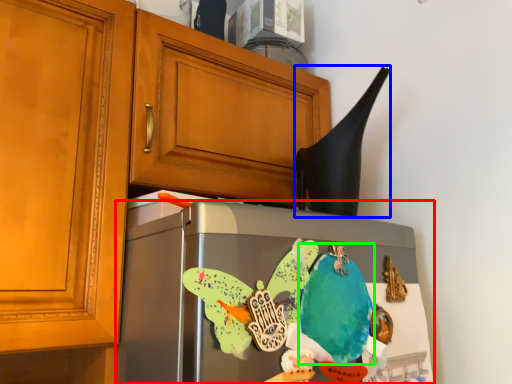
Question: Which object is the closest to the refrigerator (highlighted by a red box)? Choose among these: exhaust hood (highlighted by a blue box) or parrot (highlighted by a green box).

Choices:
 (A) exhaust hood
 (B) parrot

Answer: (B)